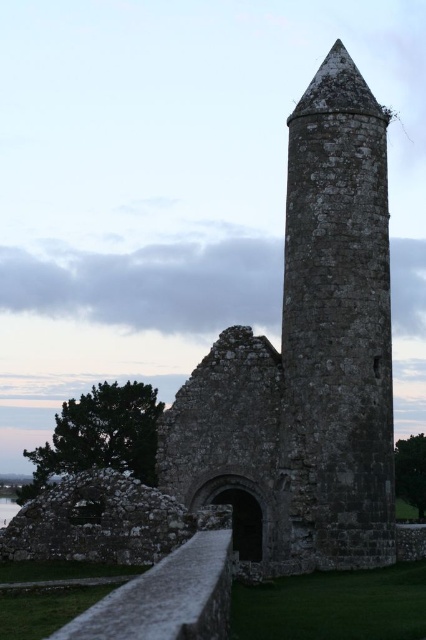
You are an architect examining the ancient stone structure. You notice two towers labeled as rustic stone tower at center and rough stone tower at center. Which one has a greater height?

The rustic stone tower at center is larger in size than the rough stone tower at center, so it also has a greater height.

You are standing at the base of the rustic stone tower at center. You want to throw a small pebble to hit the top of the tower. Given that the tower is 61.14 meters away from you, and the pebble can travel up to 60 meters, will you be able to reach the top?

The rustic stone tower at center is 61.14 meters away from the viewer. Since the pebble can only travel up to 60 meters, it will not be able to reach the top of the tower.

You are an archaeologist standing in front of the ancient stone structure. You notice two towers labeled as rustic stone tower at center and rough stone tower at center. Which tower is closer to you?

The rustic stone tower at center is closer to you since it is positioned further to the viewer than the rough stone tower at center, meaning it appears nearer in the image.